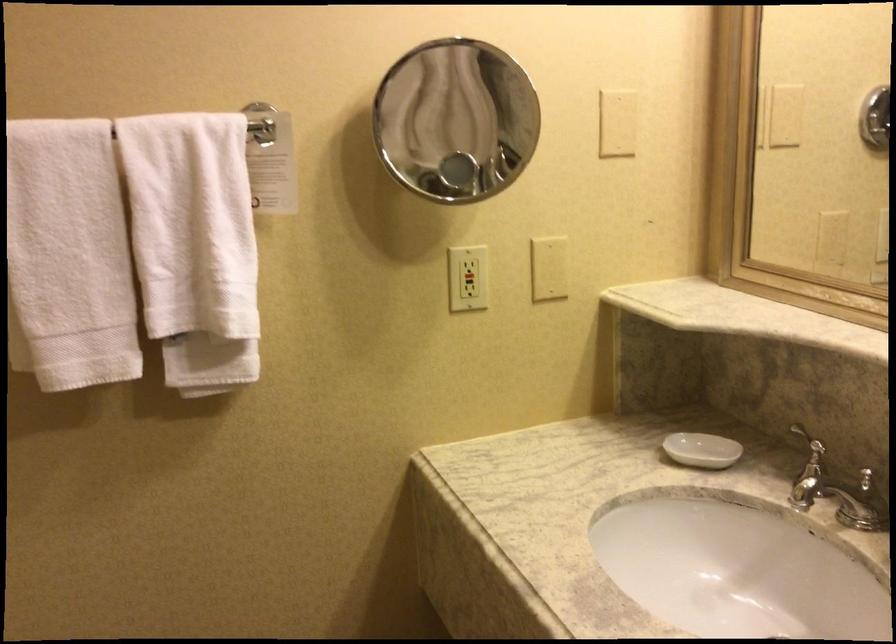
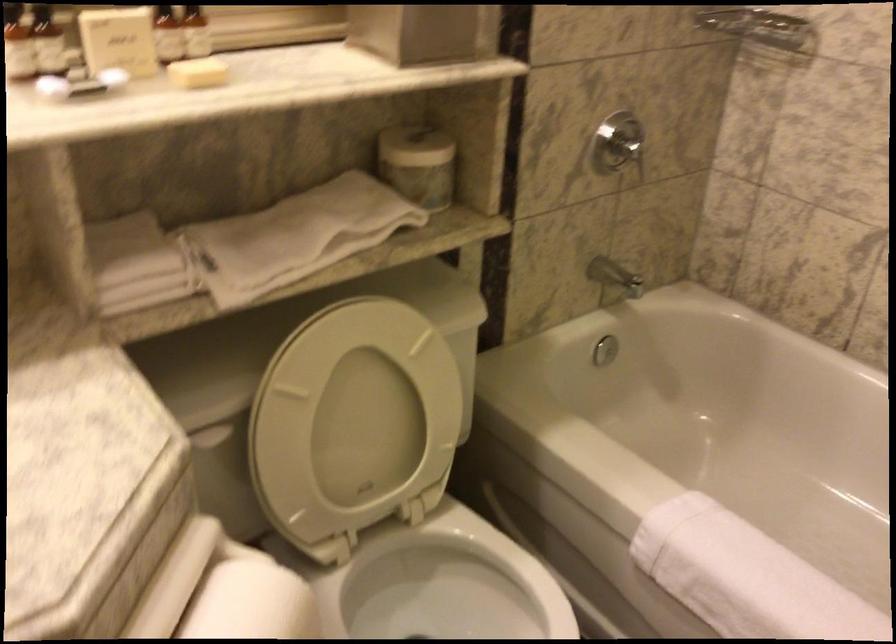
The first image is from the beginning of the video and the second image is from the end. How did the camera likely rotate when shooting the video?

The rotation direction of the camera is right-down.